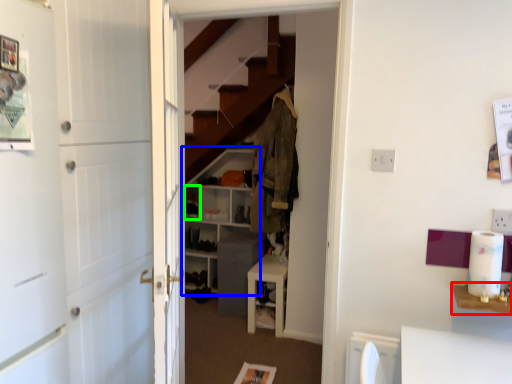
Question: Which is farther away from table (highlighted by a red box)? shelf (highlighted by a blue box) or shelf (highlighted by a green box)?

Choices:
 (A) shelf
 (B) shelf

Answer: (B)